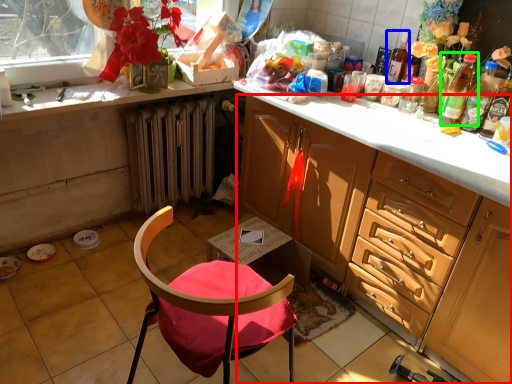
Question: Which is nearer to the cabinetry (highlighted by a red box)? bottle (highlighted by a blue box) or bottle (highlighted by a green box).

Choices:
 (A) bottle
 (B) bottle

Answer: (B)